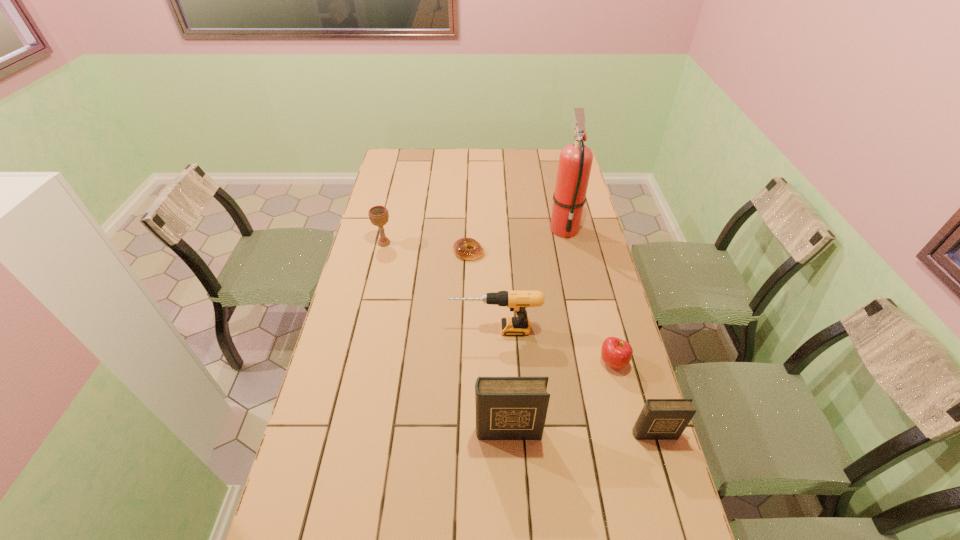
Locate an element on the screen. fire extinguisher at the right edge is located at coordinates (575, 161).

At what (x,y) coordinates should I click in order to perform the action: click on apple at the right edge. Please return your answer as a coordinate pair (x, y). Image resolution: width=960 pixels, height=540 pixels. Looking at the image, I should click on (616, 353).

At what (x,y) coordinates should I click in order to perform the action: click on free space at the far edge. Please return your answer as a coordinate pair (x, y). Looking at the image, I should click on (509, 164).

This screenshot has height=540, width=960. In the image, there is a desktop. Find the location of `vacant space at the left edge`. vacant space at the left edge is located at coordinates (356, 429).

Where is `vacant space at the right edge`? The width and height of the screenshot is (960, 540). vacant space at the right edge is located at coordinates (567, 248).

Identify the location of vacant space at the far left corner of the desktop. [x=388, y=162].

You are a GUI agent. You are given a task and a screenshot of the screen. Output one action in this format:
    pyautogui.click(x=<x>, y=<y>)
    Task: Click on the vacant space at the far right corner of the desktop
    Image resolution: width=960 pixels, height=540 pixels.
    Given the screenshot: What is the action you would take?
    pyautogui.click(x=557, y=173)

This screenshot has height=540, width=960. In order to click on empty location between the tallest object and the third nearest object in this screenshot , I will do click(588, 295).

Locate an element on the screen. This screenshot has width=960, height=540. free space between the bagel and the fire extinguisher is located at coordinates (516, 240).

You are a GUI agent. You are given a task and a screenshot of the screen. Output one action in this format:
    pyautogui.click(x=<x>, y=<y>)
    Task: Click on the vacant area between the fire extinguisher and the fifth farthest object
    
    Given the screenshot: What is the action you would take?
    pyautogui.click(x=588, y=295)